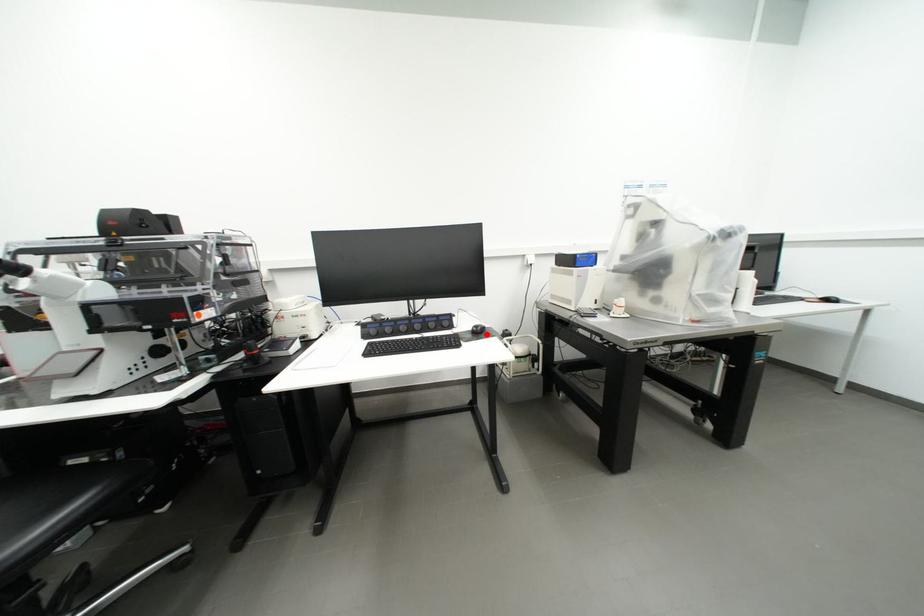
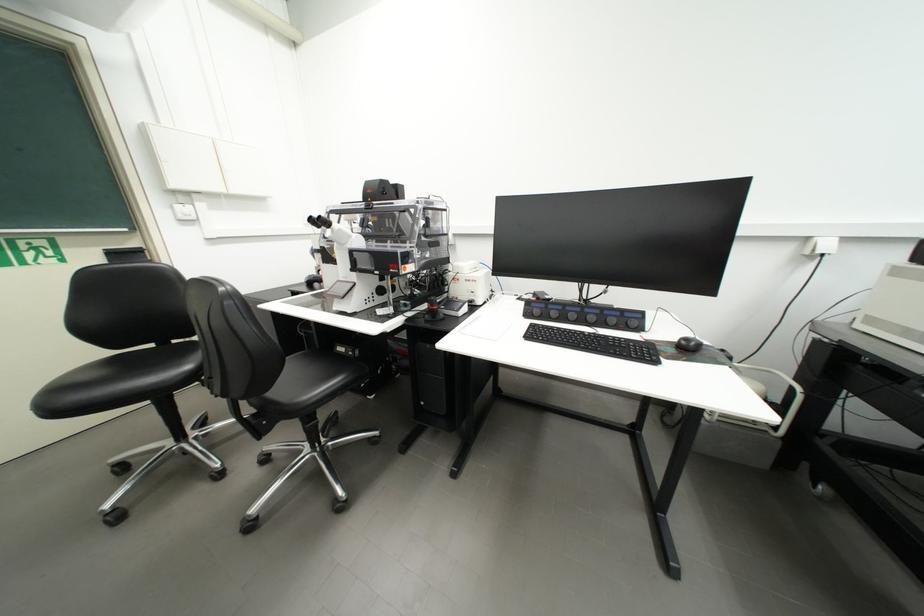
The point at the highlighted location is marked in the first image. Where is the corresponding point in the second image?

(697, 351)